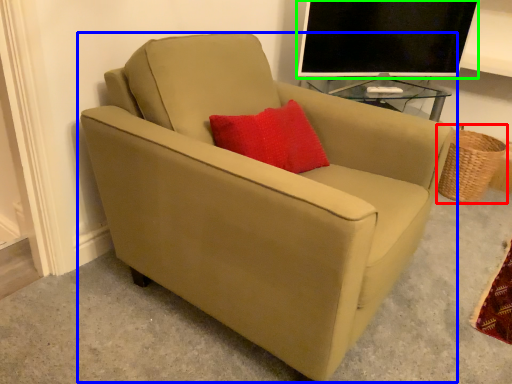
Question: Which is nearer to the basket (highlighted by a red box)? chair (highlighted by a blue box) or television (highlighted by a green box).

Choices:
 (A) chair
 (B) television

Answer: (B)